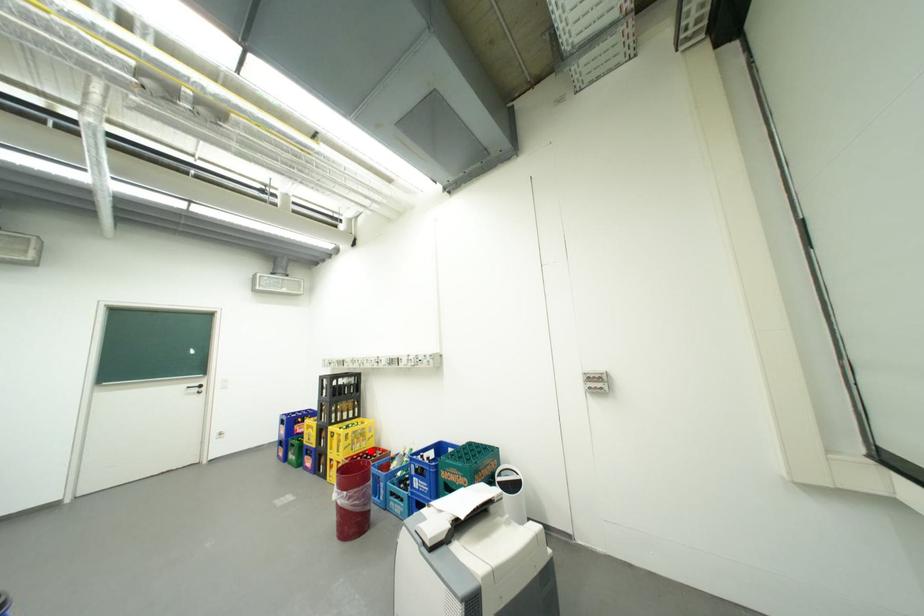
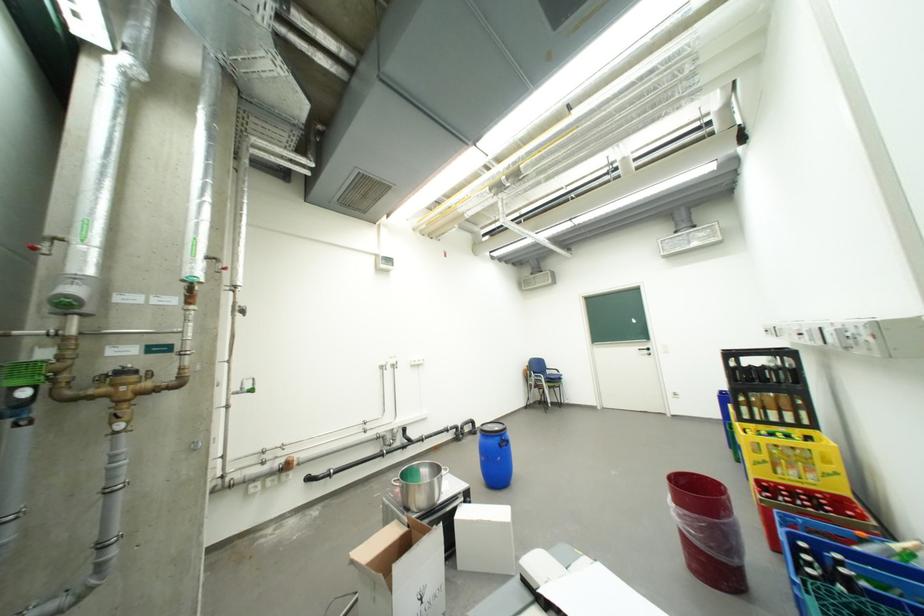
Locate, in the second image, the point that corresponds to the highlighted location in the first image.

(810, 484)